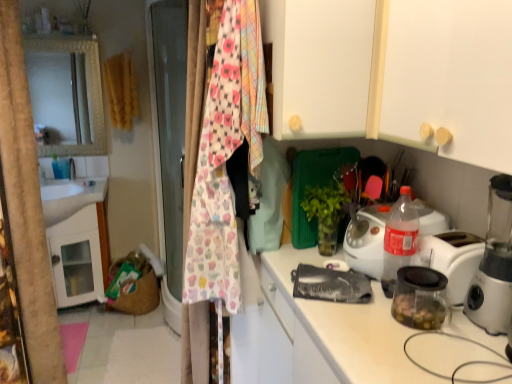
Looking at this image, measure the distance between yellow fabric clothesline at upper left, positioned as the first clothesline in back-to-front order, and camera.

The depth of yellow fabric clothesline at upper left, positioned as the first clothesline in back-to-front order, is 8.73 feet.

The image size is (512, 384). I want to click on translucent plastic bottle at left, so click(x=56, y=168).

What do you see at coordinates (70, 197) in the screenshot?
I see `white glossy sink at left` at bounding box center [70, 197].

What do you see at coordinates (494, 264) in the screenshot? I see `transparent plastic blender at right` at bounding box center [494, 264].

Describe the element at coordinates (319, 65) in the screenshot. I see `white matte cabinet at upper center` at that location.

The width and height of the screenshot is (512, 384). Identify the location of yellow fabric clothesline at upper left, which appears as the second clothesline when viewed from the right. (121, 90).

From a real-world perspective, is white matte cabinet at upper center physically located above or below yellow fabric clothesline at upper left, which is counted as the 2th clothesline, starting from the bottom?

From a real-world perspective, white matte cabinet at upper center is physically above yellow fabric clothesline at upper left, which is counted as the 2th clothesline, starting from the bottom.

Is yellow fabric clothesline at upper left, positioned as the first clothesline in back-to-front order, located within white matte cabinet at upper center?

No, white matte cabinet at upper center does not contain yellow fabric clothesline at upper left, positioned as the first clothesline in back-to-front order.

Does white matte cabinet at upper center have a lesser width compared to yellow fabric clothesline at upper left, which appears as the second clothesline when viewed from the right?

No.

Does white matte cabinet at upper center have a lesser height compared to yellow fabric clothesline at upper left, marked as the first clothesline in a top-to-bottom arrangement?

Correct, white matte cabinet at upper center is not as tall as yellow fabric clothesline at upper left, marked as the first clothesline in a top-to-bottom arrangement.

Does transparent glass jar at right have a larger size compared to white matte cabinet at upper center?

Incorrect, transparent glass jar at right is not larger than white matte cabinet at upper center.

You are a GUI agent. You are given a task and a screenshot of the screen. Output one action in this format:
    pyautogui.click(x=<x>, y=<y>)
    Task: Click on the cabinetry behind the transparent glass jar at right
    This screenshot has width=512, height=384.
    Given the screenshot: What is the action you would take?
    pyautogui.click(x=319, y=65)

Looking at this image, is transparent glass jar at right aimed at white matte cabinet at upper center?

No, transparent glass jar at right does not turn towards white matte cabinet at upper center.

From a real-world perspective, does transparent glass jar at right sit lower than white matte cabinet at upper center?

Yes, from a real-world perspective, transparent glass jar at right is below white matte cabinet at upper center.

Does white glossy sink at left have a greater height compared to yellow fabric clothesline at upper left, the 1th clothesline in the left-to-right sequence?

In fact, white glossy sink at left may be shorter than yellow fabric clothesline at upper left, the 1th clothesline in the left-to-right sequence.

How different are the orientations of white glossy sink at left and yellow fabric clothesline at upper left, positioned as the first clothesline in back-to-front order, in degrees?

4.1 degrees.

From the image's perspective, is white glossy sink at left under yellow fabric clothesline at upper left, which is counted as the 2th clothesline, starting from the bottom?

Correct, white glossy sink at left appears lower than yellow fabric clothesline at upper left, which is counted as the 2th clothesline, starting from the bottom, in the image.

Which is behind, point (81, 180) or point (121, 127)?

The point (81, 180) is behind.

Considering the points (495, 270) and (371, 18), which point is in front, point (495, 270) or point (371, 18)?

Point (495, 270)

In the image, is transparent plastic blender at right positioned in front of or behind white matte cabinet at upper center?

transparent plastic blender at right is in front of white matte cabinet at upper center.

Which of these two, transparent plastic blender at right or white matte cabinet at upper center, is smaller?

transparent plastic blender at right.

Considering the relative sizes of transparent plastic blender at right and white matte cabinet at upper center in the image provided, is transparent plastic blender at right wider than white matte cabinet at upper center?

No, transparent plastic blender at right is not wider than white matte cabinet at upper center.

Does yellow fabric clothesline at upper left, which is counted as the 2th clothesline, starting from the bottom, have a lesser width compared to translucent plastic bottle at left?

No.

From the image's perspective, which object appears higher, yellow fabric clothesline at upper left, which appears as the second clothesline when viewed from the right, or translucent plastic bottle at left?

yellow fabric clothesline at upper left, which appears as the second clothesline when viewed from the right, from the image's perspective.

Can you tell me how much yellow fabric clothesline at upper left, the 1th clothesline in the left-to-right sequence, and translucent plastic bottle at left differ in facing direction?

4.82 degrees separate the facing orientations of yellow fabric clothesline at upper left, the 1th clothesline in the left-to-right sequence, and translucent plastic bottle at left.

From the translucent plastic bottle at left, count 1st clothesline to the right and point to it. Please provide its 2D coordinates.

[(121, 90)]

Is white matte cabinet at upper center looking in the opposite direction of white glossy sink at left?

white matte cabinet at upper center does not have its back to white glossy sink at left.

Is white matte cabinet at upper center positioned in front of white glossy sink at left?

Yes, the depth of white matte cabinet at upper center is less than that of white glossy sink at left.

From the image's perspective, is white matte cabinet at upper center positioned above or below white glossy sink at left?

white matte cabinet at upper center is situated higher than white glossy sink at left in the image.

Are white matte cabinet at upper center and white glossy sink at left beside each other?

No, white matte cabinet at upper center is not in contact with white glossy sink at left.

Looking at this image, considering the relative sizes of translucent plastic bottle at left and cupcake-patterned fabric at center, which ranks as the 1th clothesline in bottom-to-top order, in the image provided, is translucent plastic bottle at left wider than cupcake-patterned fabric at center, which ranks as the 1th clothesline in bottom-to-top order,?

A: No.

Looking at this image, between translucent plastic bottle at left and cupcake-patterned fabric at center, placed as the 2th clothesline when sorted from left to right, which one has less height?

translucent plastic bottle at left.

Does translucent plastic bottle at left appear on the left side of cupcake-patterned fabric at center, arranged as the first clothesline when viewed from the front?

Correct, you'll find translucent plastic bottle at left to the left of cupcake-patterned fabric at center, arranged as the first clothesline when viewed from the front.

Could you tell me if translucent plastic bottle at left is turned towards cupcake-patterned fabric at center, which ranks as the 2th clothesline in top-to-bottom order?

No.

Where is `cabinetry located on the right of yellow fabric clothesline at upper left, the 1th clothesline in the left-to-right sequence`? cabinetry located on the right of yellow fabric clothesline at upper left, the 1th clothesline in the left-to-right sequence is located at coordinates (319, 65).

Where is `cabinetry located above the transparent glass jar at right (from a real-world perspective)`? The image size is (512, 384). cabinetry located above the transparent glass jar at right (from a real-world perspective) is located at coordinates (319, 65).

Looking at the image, which one is located closer to yellow fabric clothesline at upper left, which appears as the second clothesline when viewed from the right, translucent plastic bottle at left or transparent plastic blender at right?

translucent plastic bottle at left is closer to yellow fabric clothesline at upper left, which appears as the second clothesline when viewed from the right.

Considering their positions, is white matte cabinet at upper center positioned further to yellow fabric clothesline at upper left, acting as the 2th clothesline starting from the front, than translucent plastic bottle at left?

white matte cabinet at upper center lies further to yellow fabric clothesline at upper left, acting as the 2th clothesline starting from the front, than the other object.

When comparing their distances from transparent plastic blender at right, does cupcake-patterned fabric at center, arranged as the first clothesline when viewed from the front, or translucent plastic bottle at left seem closer?

cupcake-patterned fabric at center, arranged as the first clothesline when viewed from the front, is positioned closer to the anchor transparent plastic blender at right.

From the image, which object appears to be nearer to white glossy sink at left, white matte cabinet at upper center or cupcake-patterned fabric at center, placed as the 2th clothesline when sorted from left to right?

cupcake-patterned fabric at center, placed as the 2th clothesline when sorted from left to right.

Looking at the image, which one is located closer to white glossy sink at left, transparent plastic blender at right or translucent plastic bottle at left?

translucent plastic bottle at left.

Estimate the real-world distances between objects in this image. Which object is closer to yellow fabric clothesline at upper left, the 1th clothesline in the left-to-right sequence, white glossy sink at left or transparent glass jar at right?

white glossy sink at left.

From the image, which object appears to be nearer to translucent plastic bottle at left, yellow fabric clothesline at upper left, the 1th clothesline in the left-to-right sequence, or transparent plastic blender at right?

yellow fabric clothesline at upper left, the 1th clothesline in the left-to-right sequence.

From the image, which object appears to be farther from transparent plastic blender at right, translucent plastic bottle at left or cupcake-patterned fabric at center, placed as the second clothesline when sorted from back to front?

The object further to transparent plastic blender at right is translucent plastic bottle at left.

Locate an element on the screen. clothesline between cupcake-patterned fabric at center, placed as the second clothesline when sorted from back to front, and translucent plastic bottle at left, along the z-axis is located at coordinates (121, 90).

The image size is (512, 384). Find the location of `home appliance between transparent glass jar at right and yellow fabric clothesline at upper left, positioned as the first clothesline in back-to-front order, from front to back`. home appliance between transparent glass jar at right and yellow fabric clothesline at upper left, positioned as the first clothesline in back-to-front order, from front to back is located at coordinates (494, 264).

At what (x,y) coordinates should I click in order to perform the action: click on countertop situated between cupcake-patterned fabric at center, which ranks as the 1th clothesline in bottom-to-top order, and transparent plastic blender at right from left to right. Please return your answer as a coordinate pair (x, y). The height and width of the screenshot is (384, 512). Looking at the image, I should click on (345, 326).

The height and width of the screenshot is (384, 512). Find the location of `cabinetry between cupcake-patterned fabric at center, placed as the 2th clothesline when sorted from left to right, and yellow fabric clothesline at upper left, acting as the 2th clothesline starting from the front, in the front-back direction`. cabinetry between cupcake-patterned fabric at center, placed as the 2th clothesline when sorted from left to right, and yellow fabric clothesline at upper left, acting as the 2th clothesline starting from the front, in the front-back direction is located at coordinates (319, 65).